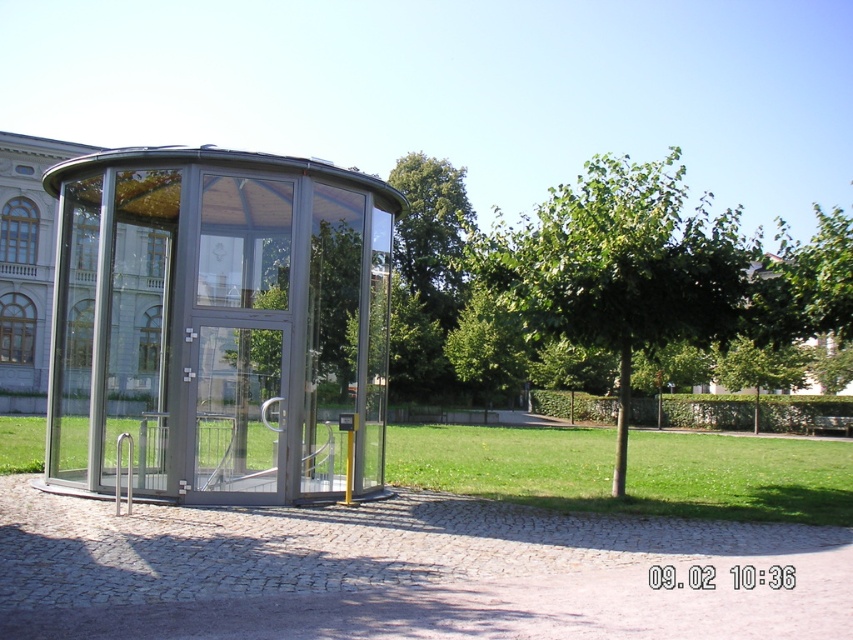
Question: Is transparent glass gazebo at center behind transparent glass door at center?

Choices:
 (A) yes
 (B) no

Answer: (B)

Question: Which object is the closest to the transparent glass gazebo at center?

Choices:
 (A) transparent glass door at center
 (B) green leafy tree at center

Answer: (A)

Question: Which point is farther to the camera?

Choices:
 (A) green leafy tree at center
 (B) transparent glass door at center

Answer: (A)

Question: Is transparent glass gazebo at center to the right of transparent glass door at center from the viewer's perspective?

Choices:
 (A) no
 (B) yes

Answer: (A)

Question: Does transparent glass gazebo at center appear over green leafy tree at center?

Choices:
 (A) no
 (B) yes

Answer: (A)

Question: Which is farther from the green leafy tree at center?

Choices:
 (A) transparent glass door at center
 (B) transparent glass gazebo at center

Answer: (B)